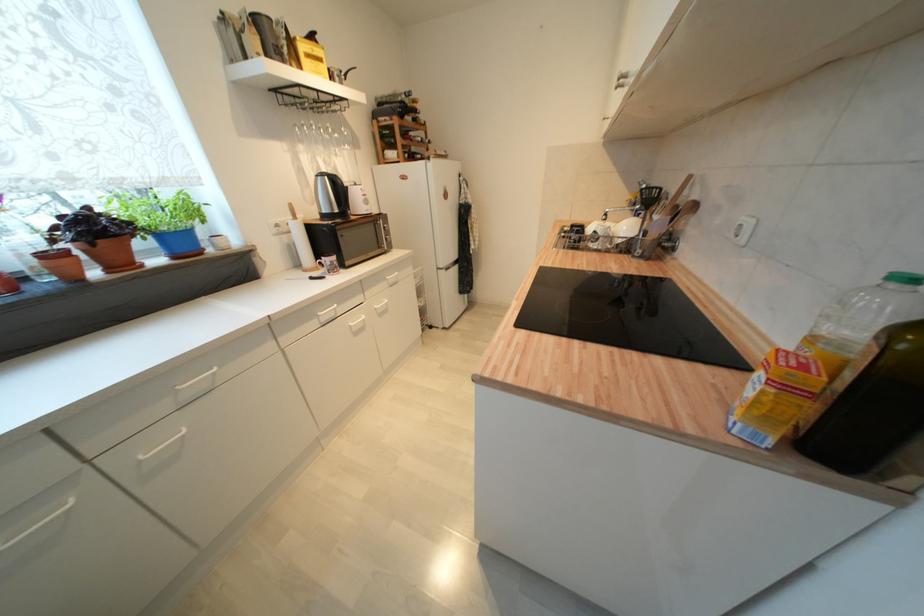
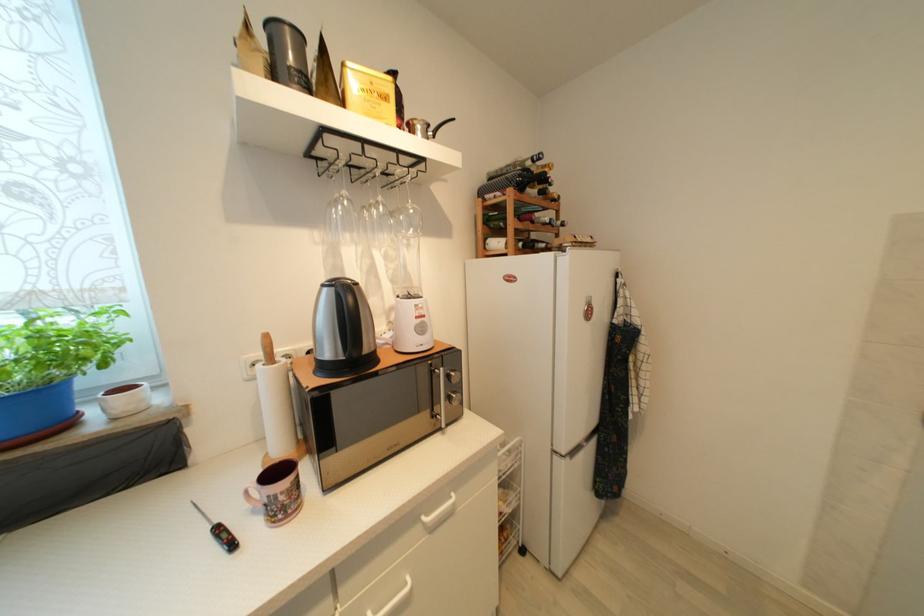
The point at (199, 214) is marked in the first image. Where is the corresponding point in the second image?

(77, 353)